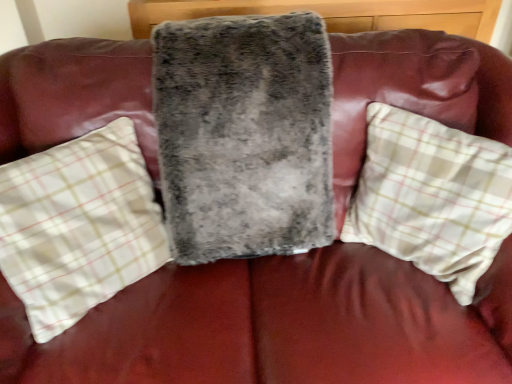
Question: Is fuzzy gray blanket at center thinner than fuzzy gray pillow at center, which ranks as the second pillow in right-to-left order?

Choices:
 (A) no
 (B) yes

Answer: (A)

Question: Considering the relative sizes of fuzzy gray blanket at center and fuzzy gray pillow at center, which ranks as the second pillow in right-to-left order, in the image provided, is fuzzy gray blanket at center smaller than fuzzy gray pillow at center, which ranks as the second pillow in right-to-left order,?

Choices:
 (A) no
 (B) yes

Answer: (A)

Question: Is fuzzy gray blanket at center taller than fuzzy gray pillow at center, which ranks as the second pillow in right-to-left order?

Choices:
 (A) yes
 (B) no

Answer: (A)

Question: Does fuzzy gray blanket at center turn towards fuzzy gray pillow at center, the 1th pillow from the left?

Choices:
 (A) yes
 (B) no

Answer: (B)

Question: Would you consider fuzzy gray blanket at center to be distant from fuzzy gray pillow at center, the 1th pillow from the left?

Choices:
 (A) no
 (B) yes

Answer: (A)

Question: Is fuzzy gray blanket at center oriented away from fuzzy gray pillow at center, which ranks as the second pillow in right-to-left order?

Choices:
 (A) no
 (B) yes

Answer: (A)

Question: Does fuzzy gray pillow at center, which ranks as the second pillow in right-to-left order, have a larger size compared to white plaid pillow at right, which ranks as the first pillow in right-to-left order?

Choices:
 (A) no
 (B) yes

Answer: (B)

Question: Does fuzzy gray pillow at center, the 1th pillow from the left, have a greater width compared to white plaid pillow at right, which is the 2th pillow in left-to-right order?

Choices:
 (A) yes
 (B) no

Answer: (A)

Question: Considering the relative positions of fuzzy gray pillow at center, which ranks as the second pillow in right-to-left order, and white plaid pillow at right, which is the 2th pillow in left-to-right order, in the image provided, is fuzzy gray pillow at center, which ranks as the second pillow in right-to-left order, to the left of white plaid pillow at right, which is the 2th pillow in left-to-right order, from the viewer's perspective?

Choices:
 (A) no
 (B) yes

Answer: (B)

Question: Are fuzzy gray pillow at center, the 1th pillow from the left, and white plaid pillow at right, which ranks as the first pillow in right-to-left order, far apart?

Choices:
 (A) no
 (B) yes

Answer: (A)

Question: Considering the relative sizes of fuzzy gray pillow at center, the 1th pillow from the left, and white plaid pillow at right, which ranks as the first pillow in right-to-left order, in the image provided, is fuzzy gray pillow at center, the 1th pillow from the left, thinner than white plaid pillow at right, which ranks as the first pillow in right-to-left order,?

Choices:
 (A) yes
 (B) no

Answer: (B)

Question: Is fuzzy gray pillow at center, which ranks as the second pillow in right-to-left order, shorter than white plaid pillow at right, which is the 2th pillow in left-to-right order?

Choices:
 (A) no
 (B) yes

Answer: (A)

Question: Is fuzzy gray pillow at center, which ranks as the second pillow in right-to-left order, far away from fuzzy gray blanket at center?

Choices:
 (A) no
 (B) yes

Answer: (A)